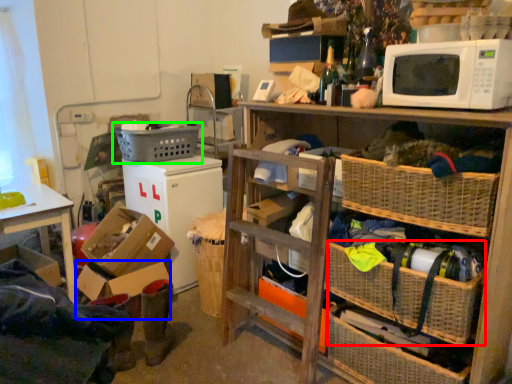
Question: Estimate the real-world distances between objects in this image. Which object is farther from basket (highlighted by a red box), box (highlighted by a blue box) or picnic basket (highlighted by a green box)?

Choices:
 (A) box
 (B) picnic basket

Answer: (B)